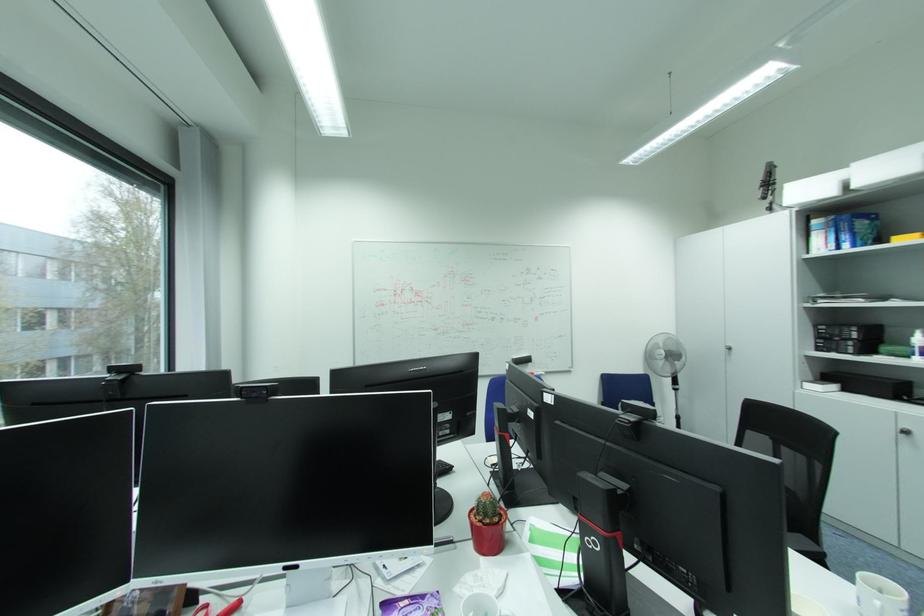
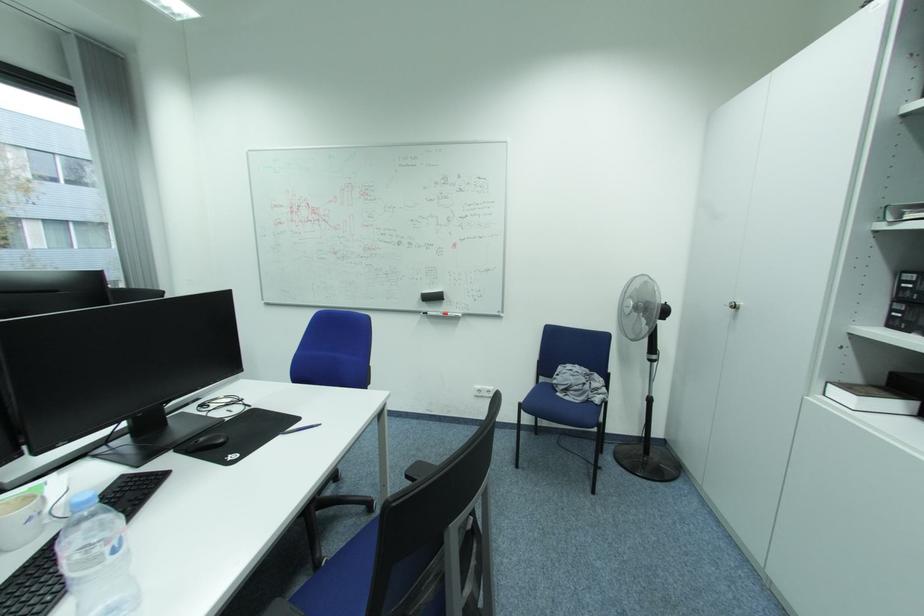
What movement of the cameraman would produce the second image?

The cameraman walked toward right, forward.